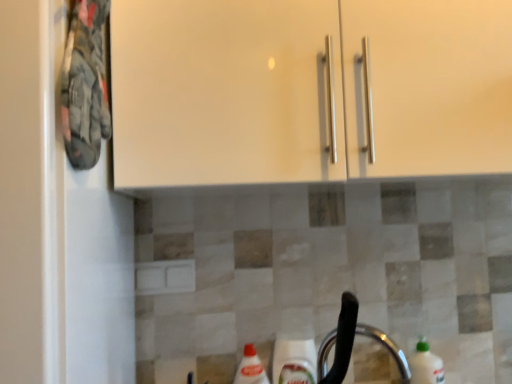
Question: From the image's perspective, is green plastic bottle at lower right below silver metallic faucet at lower center?

Choices:
 (A) yes
 (B) no

Answer: (A)

Question: Considering the relative sizes of green plastic bottle at lower right and silver metallic faucet at lower center in the image provided, is green plastic bottle at lower right bigger than silver metallic faucet at lower center?

Choices:
 (A) yes
 (B) no

Answer: (B)

Question: Is green plastic bottle at lower right closer to camera compared to silver metallic faucet at lower center?

Choices:
 (A) yes
 (B) no

Answer: (B)

Question: Is silver metallic faucet at lower center surrounded by green plastic bottle at lower right?

Choices:
 (A) yes
 (B) no

Answer: (B)

Question: Is green plastic bottle at lower right taller than silver metallic faucet at lower center?

Choices:
 (A) no
 (B) yes

Answer: (B)

Question: Is green plastic bottle at lower right placed right next to silver metallic faucet at lower center?

Choices:
 (A) yes
 (B) no

Answer: (A)

Question: Considering the relative sizes of silver metallic faucet at lower center and green plastic bottle at lower right in the image provided, is silver metallic faucet at lower center wider than green plastic bottle at lower right?

Choices:
 (A) yes
 (B) no

Answer: (A)

Question: Is silver metallic faucet at lower center facing away from green plastic bottle at lower right?

Choices:
 (A) no
 (B) yes

Answer: (A)

Question: Considering the relative positions of silver metallic faucet at lower center and green plastic bottle at lower right in the image provided, is silver metallic faucet at lower center behind green plastic bottle at lower right?

Choices:
 (A) yes
 (B) no

Answer: (B)

Question: Considering the relative sizes of silver metallic faucet at lower center and green plastic bottle at lower right in the image provided, is silver metallic faucet at lower center thinner than green plastic bottle at lower right?

Choices:
 (A) no
 (B) yes

Answer: (A)

Question: From the image's perspective, would you say silver metallic faucet at lower center is shown under green plastic bottle at lower right?

Choices:
 (A) no
 (B) yes

Answer: (A)

Question: Could you tell me if silver metallic faucet at lower center is facing green plastic bottle at lower right?

Choices:
 (A) yes
 (B) no

Answer: (A)

Question: Is green plastic bottle at lower right wider or thinner than silver metallic faucet at lower center?

Choices:
 (A) thin
 (B) wide

Answer: (A)